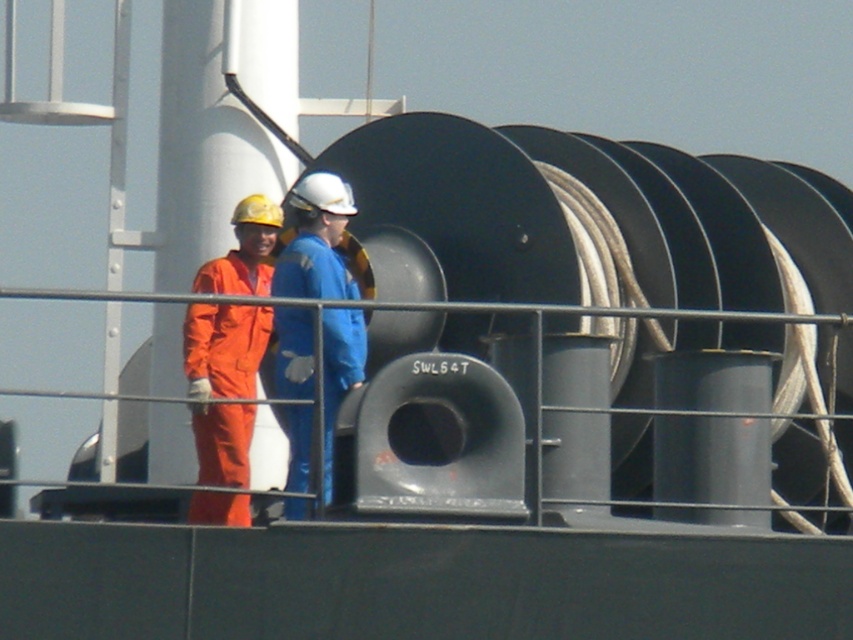
You are a safety inspector on the deck of a vessel. You need to reach a point marked at coordinates (228, 278) for an inspection. The nearest large cylindrical spool of cable is located 20 meters away from you. Can you safely walk to the point without going around the spool?

The point at coordinates (228, 278) is 45.41 meters from the viewer, which is farther than the 20 meters distance to the nearest spool. Therefore, you would need to walk past the spool to reach the point, so you can safely walk directly to the point without needing to go around it.

You are a safety inspector assessing the deck of a vessel. You notice the orange coveralls at left and the blue matte coveralls at center. Which set of coveralls is more appropriate for the current task if the task requires a larger size for visibility?

The orange coveralls at left is more appropriate because it has a larger size compared to the blue matte coveralls at center, making it more visible.

You are a safety inspector on the deck of a vessel. You need to approach both the orange coveralls at left and the blue matte coveralls at center for inspection. Which individual should you inspect first based on their position relative to you?

You should inspect the orange coveralls at left first because they are closer to you than the blue matte coveralls at center.